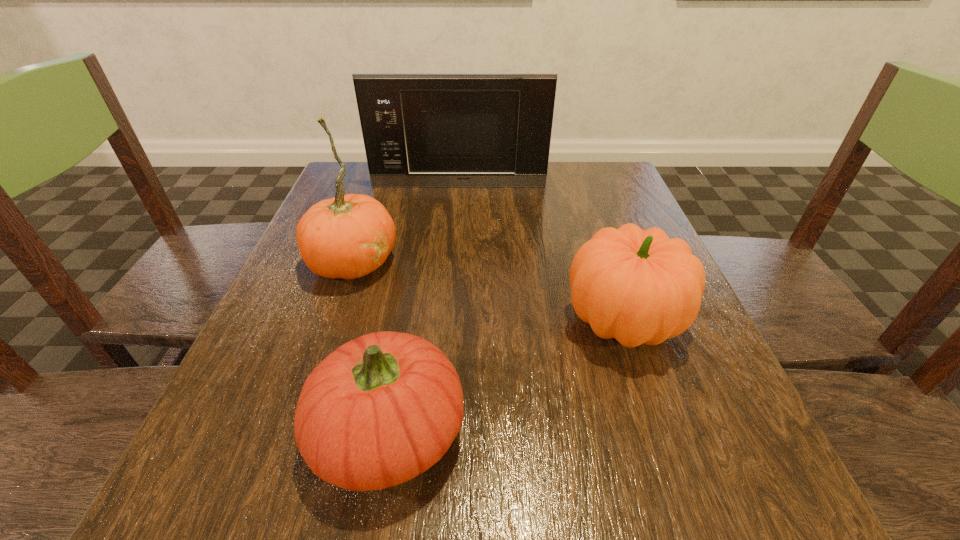
Where is `microwave oven situated at the left edge`? The width and height of the screenshot is (960, 540). microwave oven situated at the left edge is located at coordinates (420, 130).

Where is `object present at the right edge`? This screenshot has height=540, width=960. object present at the right edge is located at coordinates (636, 286).

This screenshot has height=540, width=960. In order to click on object at the far left corner in this screenshot , I will do `click(420, 130)`.

Find the location of a particular element. Image resolution: width=960 pixels, height=540 pixels. object located in the near left corner section of the desktop is located at coordinates (381, 409).

Locate an element on the screen. vacant point at the far edge is located at coordinates (429, 190).

The width and height of the screenshot is (960, 540). In the image, there is a desktop. What are the coordinates of `vacant space at the near edge` in the screenshot? It's located at (575, 513).

What are the coordinates of `vacant space at the right edge of the desktop` in the screenshot? It's located at (664, 346).

In the image, there is a desktop. Identify the location of vacant space at the near left corner. click(213, 461).

This screenshot has height=540, width=960. I want to click on vacant space at the far right corner, so click(585, 193).

Identify the location of free spot between the rightmost pumpkin and the nearest object. [x=506, y=377].